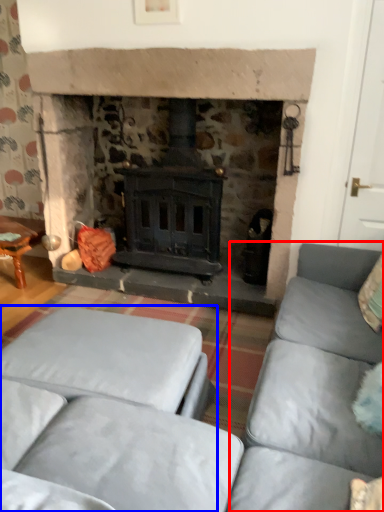
Question: Among these objects, which one is farthest to the camera, couch (highlighted by a red box) or studio couch (highlighted by a blue box)?

Choices:
 (A) couch
 (B) studio couch

Answer: (B)